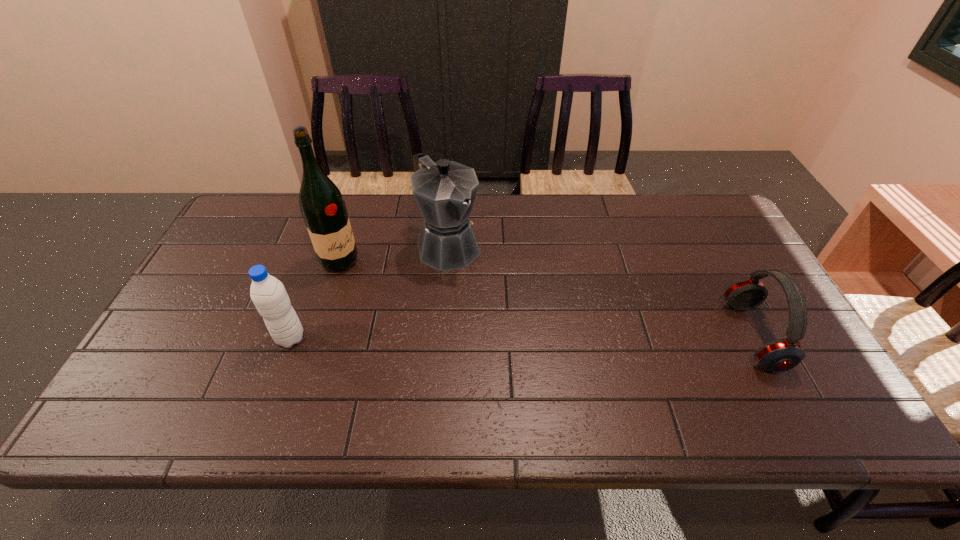
Where is `free region at the left edge of the desktop`? The height and width of the screenshot is (540, 960). free region at the left edge of the desktop is located at coordinates (227, 281).

Where is `free spot at the right edge of the desktop`? free spot at the right edge of the desktop is located at coordinates (x=780, y=338).

Locate an element on the screen. The width and height of the screenshot is (960, 540). vacant space at the far left corner of the desktop is located at coordinates (253, 200).

This screenshot has height=540, width=960. What are the coordinates of `free space at the far right corner of the desktop` in the screenshot? It's located at (682, 195).

You are a GUI agent. You are given a task and a screenshot of the screen. Output one action in this format:
    pyautogui.click(x=<x>, y=<y>)
    Task: Click on the empty space between the earphone and the third shortest object
    
    Given the screenshot: What is the action you would take?
    pyautogui.click(x=601, y=291)

I want to click on unoccupied position between the tallest object and the water bottle, so click(315, 300).

Where is `unoccupied position between the earphone and the liquor`? This screenshot has height=540, width=960. unoccupied position between the earphone and the liquor is located at coordinates (546, 299).

What are the coordinates of `vacant space that's between the coffeepot and the earphone` in the screenshot? It's located at (601, 291).

Find the location of a particular element. This screenshot has height=540, width=960. free spot between the second object from right to left and the shortest object is located at coordinates (601, 291).

Find the location of `vacant region between the liquor and the rightmost object`. vacant region between the liquor and the rightmost object is located at coordinates (546, 299).